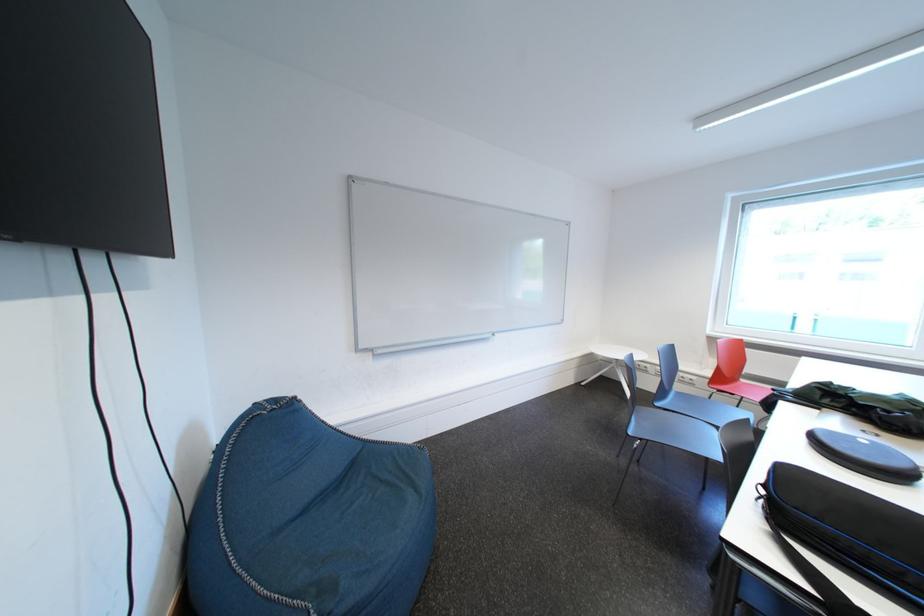
The location [849,528] corresponds to which object?

It refers to a black zippered case.